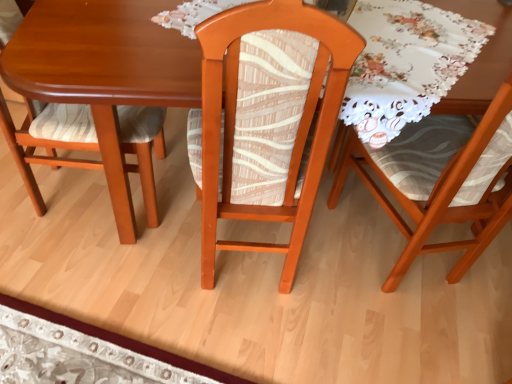
This screenshot has width=512, height=384. I want to click on free space that is in between wooden chair at center, which appears as the second chair when viewed from the right, and matte wood chair at left, the 1th chair in the left-to-right sequence, so click(x=142, y=232).